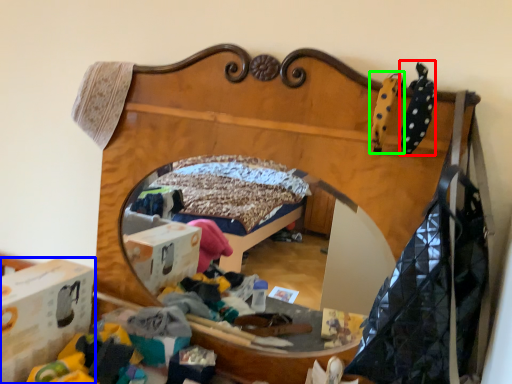
Question: Which object is positioned farthest from clothing (highlighted by a red box)? Select from cardboard box (highlighted by a blue box) and toy (highlighted by a green box).

Choices:
 (A) cardboard box
 (B) toy

Answer: (A)